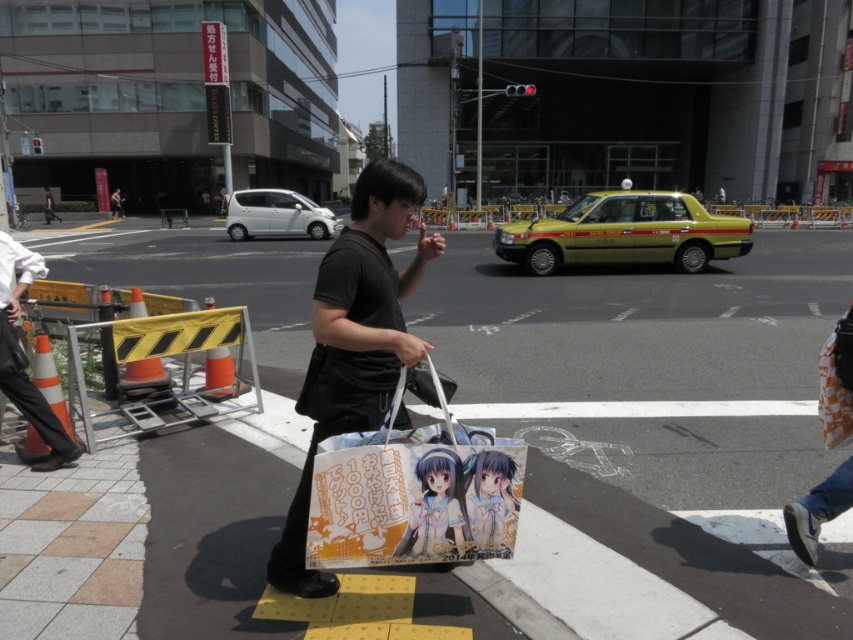
Question: Among these objects, which one is farthest from the camera?

Choices:
 (A) yellow matte taxi at center
 (B) dark gray shirt at center
 (C) glossy anime poster at center

Answer: (B)

Question: Which is nearer to the black leather pants at left?

Choices:
 (A) dark gray shirt at center
 (B) glossy anime poster at center
 (C) matte black bag at center
 (D) smooth concrete pavement at center

Answer: (B)

Question: Is black matte shirt at center wider than smooth matte anime girl at center?

Choices:
 (A) no
 (B) yes

Answer: (B)

Question: Does glossy anime poster at center appear on the right side of smooth matte anime girl at center?

Choices:
 (A) no
 (B) yes

Answer: (A)

Question: Can you confirm if yellow matte taxi at center is smaller than matte black bag at center?

Choices:
 (A) no
 (B) yes

Answer: (A)

Question: Among these objects, which one is nearest to the camera?

Choices:
 (A) glossy anime poster at center
 (B) smooth concrete pavement at center
 (C) yellow matte taxi at center

Answer: (A)